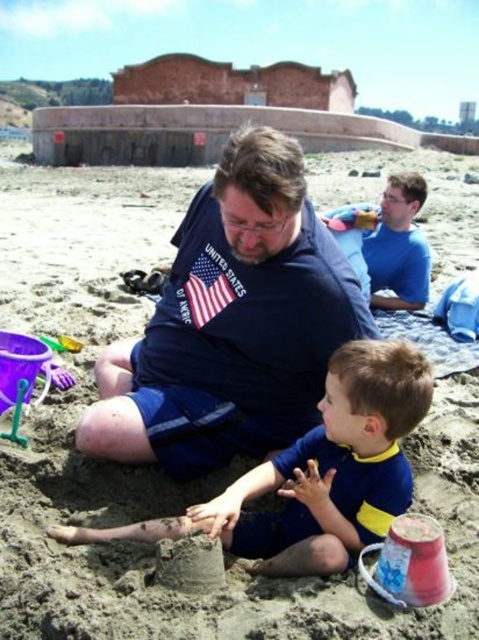
Question: Is blue cotton shirt at center above blue smooth shirt at upper right?

Choices:
 (A) yes
 (B) no

Answer: (B)

Question: Is blue cotton shirt at center below blue smooth shirt at upper right?

Choices:
 (A) yes
 (B) no

Answer: (A)

Question: Considering the real-world distances, which object is closest to the blue/yellow swimsuit at center?

Choices:
 (A) blue cotton shirt at center
 (B) plastic bucket at lower right
 (C) blue smooth shirt at upper right

Answer: (B)

Question: Is blue cotton shirt at center closer to camera compared to blue smooth shirt at upper right?

Choices:
 (A) no
 (B) yes

Answer: (B)

Question: Which object appears farthest from the camera in this image?

Choices:
 (A) plastic bucket at lower right
 (B) blue/yellow swimsuit at center
 (C) blue smooth shirt at upper right
 (D) blue cotton shirt at center

Answer: (C)

Question: Which of the following is the farthest from the observer?

Choices:
 (A) blue/yellow swimsuit at center
 (B) blue cotton shirt at center
 (C) blue smooth shirt at upper right
 (D) plastic bucket at lower right

Answer: (C)